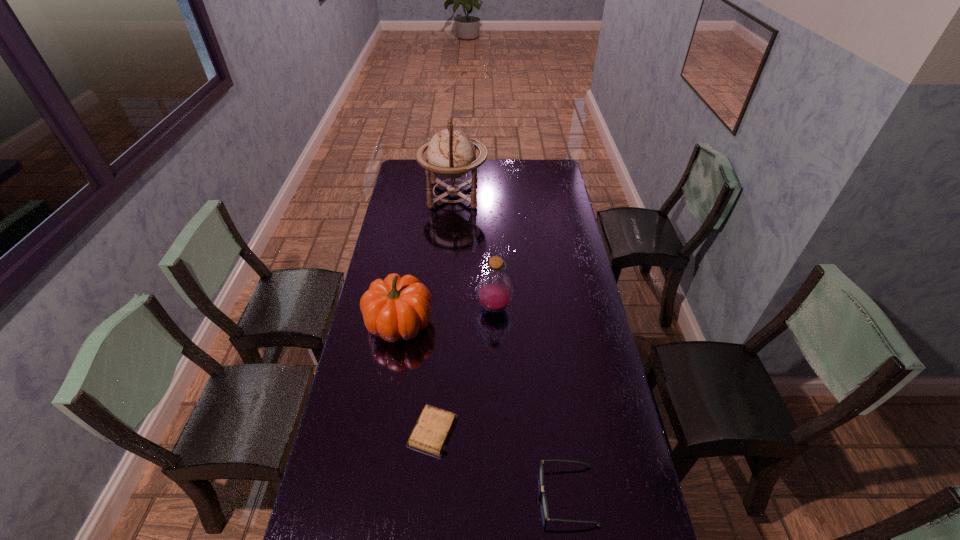
Locate an element on the screen. The width and height of the screenshot is (960, 540). free space at the far edge of the desktop is located at coordinates (487, 163).

You are a GUI agent. You are given a task and a screenshot of the screen. Output one action in this format:
    pyautogui.click(x=<x>, y=<y>)
    Task: Click on the vacant space at the left edge of the desktop
    
    Given the screenshot: What is the action you would take?
    pyautogui.click(x=390, y=227)

I want to click on vacant region at the right edge of the desktop, so click(594, 333).

Find the location of a particular element. vacant space that's between the spectacles and the fourth farthest object is located at coordinates (500, 463).

At what (x,y) coordinates should I click in order to perform the action: click on free space that is in between the farthest object and the fourth farthest object. Please return your answer as a coordinate pair (x, y). Image resolution: width=960 pixels, height=540 pixels. Looking at the image, I should click on (444, 313).

Locate an element on the screen. The image size is (960, 540). free space between the diary and the globe is located at coordinates (444, 313).

This screenshot has width=960, height=540. Find the location of `vacant area between the diary and the rightmost object`. vacant area between the diary and the rightmost object is located at coordinates (500, 463).

The height and width of the screenshot is (540, 960). I want to click on free point between the fourth farthest object and the bottle, so click(464, 369).

This screenshot has height=540, width=960. Identify the location of vacant space that is in between the bottle and the diary. (464, 369).

Where is `blank region between the fourth tallest object and the diary`? The image size is (960, 540). blank region between the fourth tallest object and the diary is located at coordinates (500, 463).